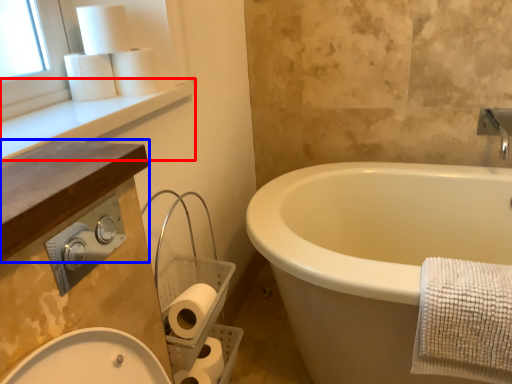
Question: Among these objects, which one is nearest to the camera, window sill (highlighted by a red box) or counter top (highlighted by a blue box)?

Choices:
 (A) window sill
 (B) counter top

Answer: (B)